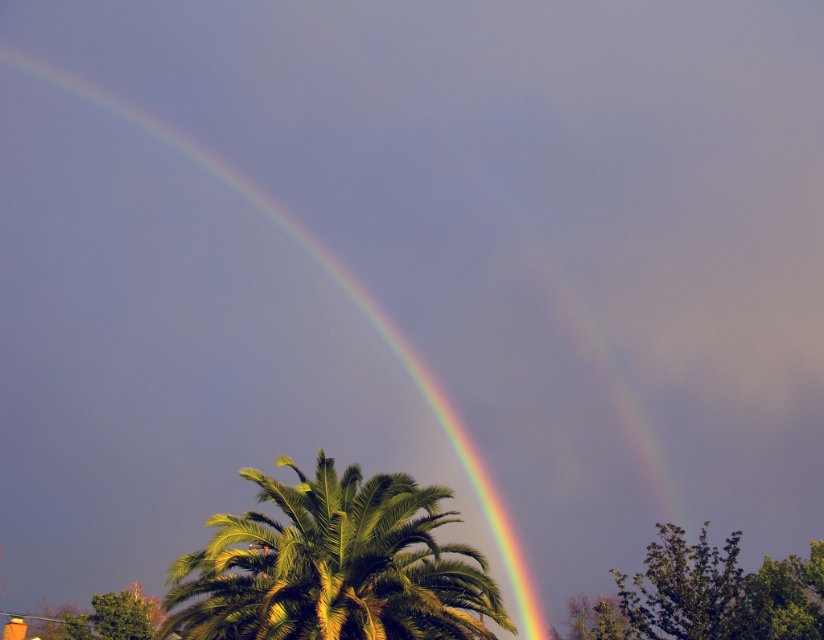
Question: Which point is farther from the camera taking this photo?

Choices:
 (A) [x=288, y=488]
 (B) [x=495, y=536]

Answer: (B)

Question: Among these objects, which one is farthest from the camera?

Choices:
 (A) green leafy palm tree at center
 (B) rainbow at upper center

Answer: (B)

Question: Can you confirm if green leafy palm tree at center is bigger than rainbow at upper center?

Choices:
 (A) no
 (B) yes

Answer: (A)

Question: Does green leafy palm tree at center appear under rainbow at upper center?

Choices:
 (A) yes
 (B) no

Answer: (A)

Question: Considering the relative positions of green leafy palm tree at center and rainbow at upper center in the image provided, where is green leafy palm tree at center located with respect to rainbow at upper center?

Choices:
 (A) above
 (B) below

Answer: (B)